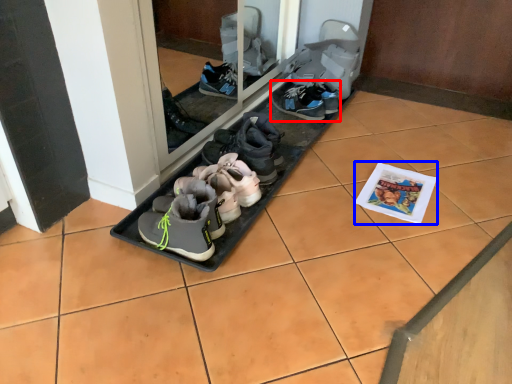
Question: Which object is closer to the camera taking this photo, footwear (highlighted by a red box) or magazine (highlighted by a blue box)?

Choices:
 (A) footwear
 (B) magazine

Answer: (B)